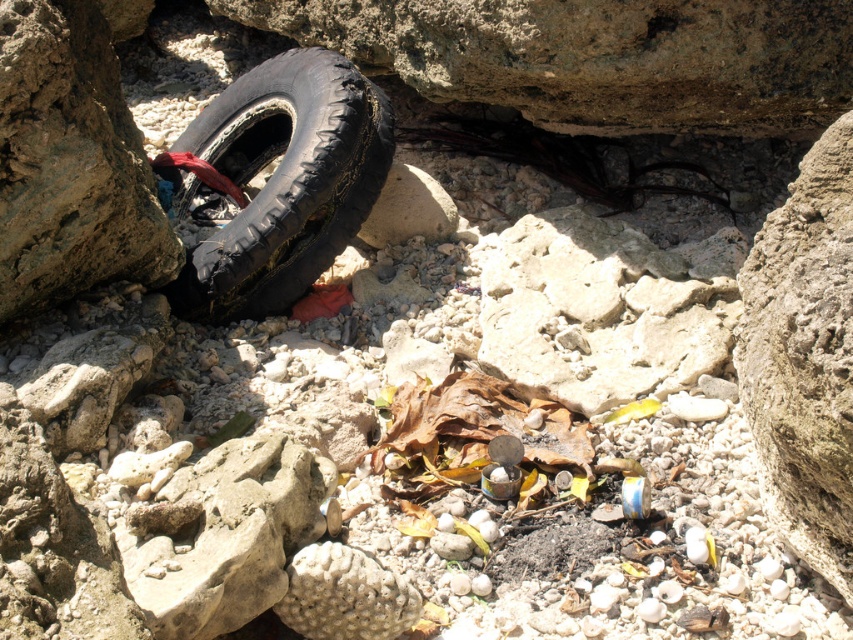
Question: Does black rubber tire at left have a smaller size compared to rough textured rock at center?

Choices:
 (A) yes
 (B) no

Answer: (B)

Question: Among these objects, which one is farthest from the camera?

Choices:
 (A) black rubber tire at left
 (B) rough textured rock at center

Answer: (A)

Question: Does black rubber tire at left have a smaller size compared to rough textured rock at center?

Choices:
 (A) no
 (B) yes

Answer: (A)

Question: Can you confirm if black rubber tire at left is positioned to the left of rough textured rock at center?

Choices:
 (A) no
 (B) yes

Answer: (B)

Question: Which point is closer to the camera?

Choices:
 (A) black rubber tire at left
 (B) rough textured rock at center

Answer: (B)

Question: Which object appears farthest from the camera in this image?

Choices:
 (A) black rubber tire at left
 (B) rough textured rock at center

Answer: (A)